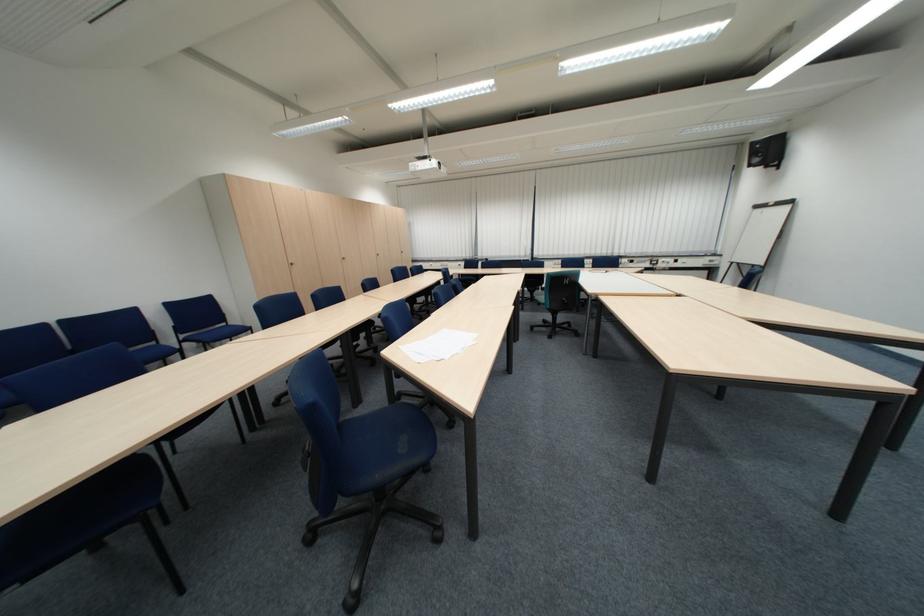
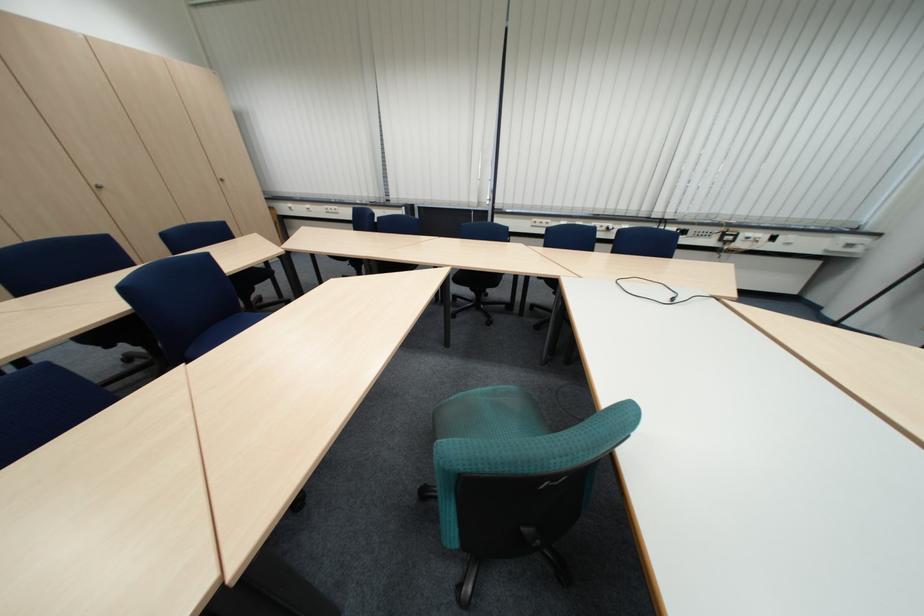
Locate, in the second image, the point that corresponds to pixel 675 261 in the first image.

(759, 235)